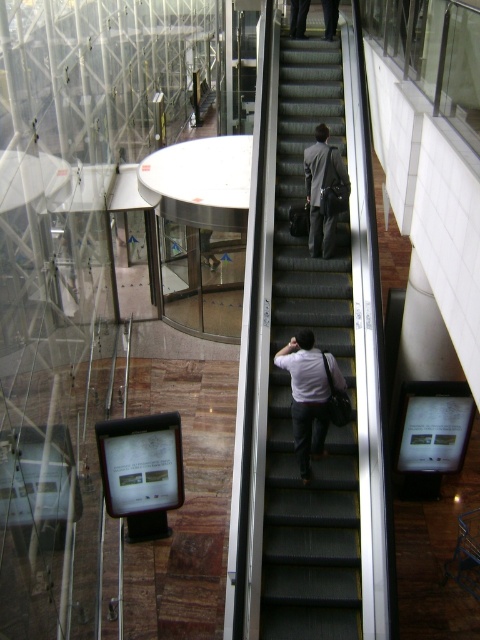
Locate an element on the screen. The image size is (480, 640). white matte shirt at center is located at coordinates (309, 394).

Who is lower down, white matte shirt at center or gray suit at center?

white matte shirt at center is lower down.

Who is more distant from viewer, [315,376] or [313,193]?

Point [313,193]

Where is `white matte shirt at center`? The image size is (480, 640). white matte shirt at center is located at coordinates (309, 394).

Which is more to the right, black carpeted stairs at center or white matte shirt at center?

black carpeted stairs at center

Who is more forward, (291, 554) or (288, 362)?

Point (291, 554)

Image resolution: width=480 pixels, height=640 pixels. In order to click on black carpeted stairs at center in this screenshot , I will do `click(309, 532)`.

Who is more forward, (323, 484) or (321, 129)?

Point (323, 484) is more forward.

Between black carpeted stairs at center and gray suit at center, which one is positioned higher?

gray suit at center is above.

Locate an element on the screen. The width and height of the screenshot is (480, 640). black carpeted stairs at center is located at coordinates coord(309,532).